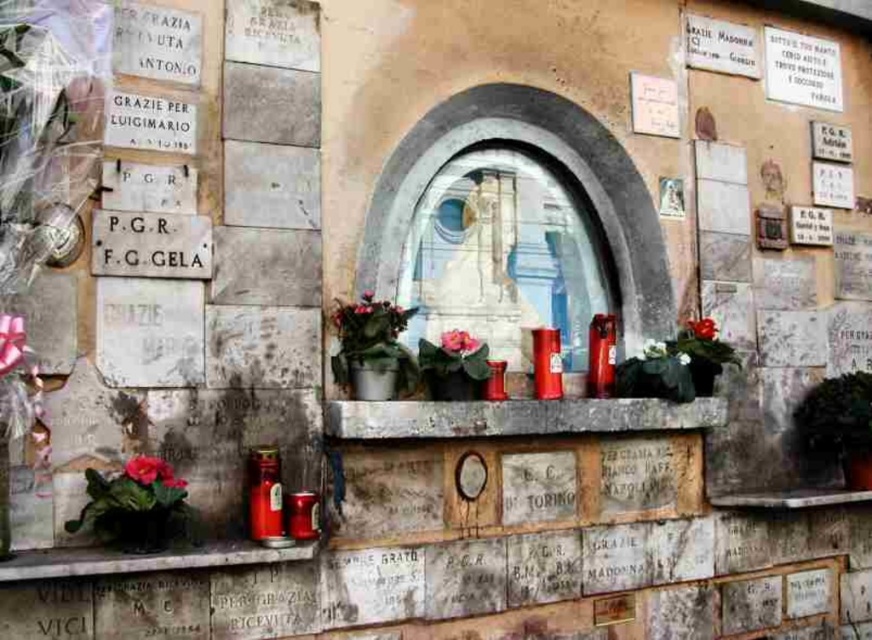
Consider the image. Does white stone plaque at left have a lesser width compared to matte concrete ledge at lower left?

Correct, white stone plaque at left's width is less than matte concrete ledge at lower left's.

Is white stone plaque at left wider than matte concrete ledge at lower left?

In fact, white stone plaque at left might be narrower than matte concrete ledge at lower left.

Describe the element at coordinates (154, 204) in the screenshot. This screenshot has width=872, height=640. I see `white stone plaque at left` at that location.

At what (x,y) coordinates should I click in order to perform the action: click on white stone plaque at left. Please return your answer as a coordinate pair (x, y). Looking at the image, I should click on (154, 204).

Is point (117, 552) positioned before point (140, 461)?

No, it is not.

Who is positioned more to the left, matte concrete ledge at lower left or matte pink flower at lower left?

From the viewer's perspective, matte pink flower at lower left appears more on the left side.

Measure the distance between matte concrete ledge at lower left and camera.

They are 6.90 feet apart.

At what (x,y) coordinates should I click in order to perform the action: click on matte concrete ledge at lower left. Please return your answer as a coordinate pair (x, y). The height and width of the screenshot is (640, 872). Looking at the image, I should click on (144, 560).

Between pink matte flower at center and green matte flower at center, which one appears on the right side from the viewer's perspective?

green matte flower at center is more to the right.

Where is `pink matte flower at center`? pink matte flower at center is located at coordinates (458, 342).

Identify the location of pink matte flower at center. (458, 342).